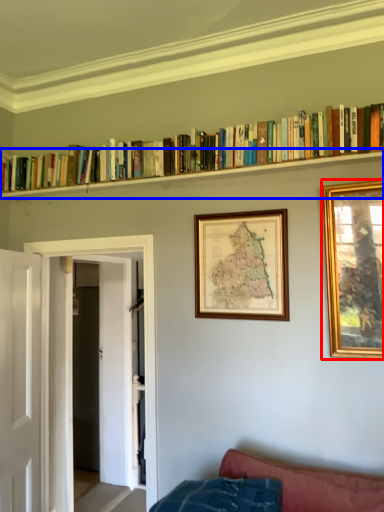
Question: Among these objects, which one is nearest to the camera, picture frame (highlighted by a red box) or shelf (highlighted by a blue box)?

Choices:
 (A) picture frame
 (B) shelf

Answer: (A)